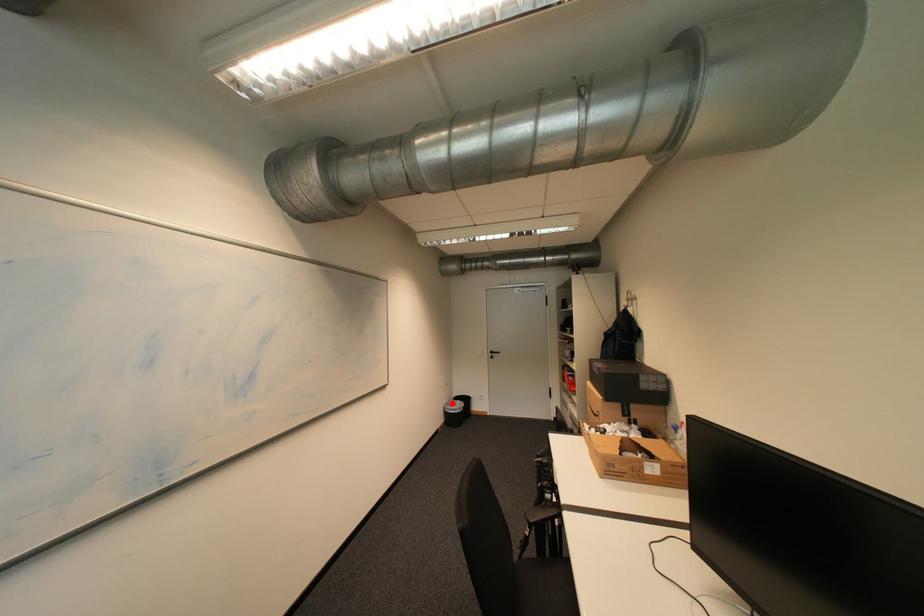
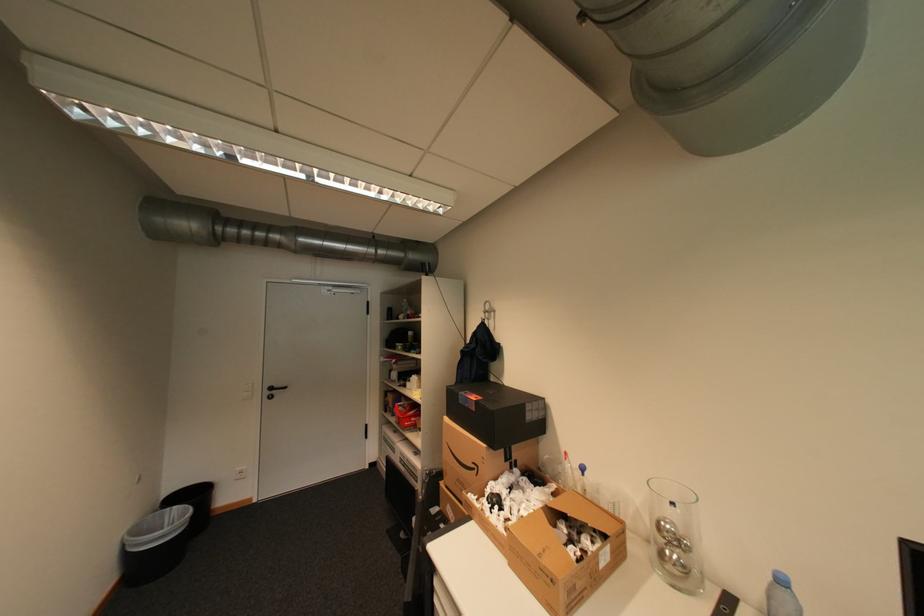
Question: A red point is marked in image1. In image2, is the corresponding 3D point closer to the camera or farther? Reply with the corresponding letter.

Choices:
 (A) The corresponding 3D point is closer.
 (B) The corresponding 3D point is farther.

Answer: (A)